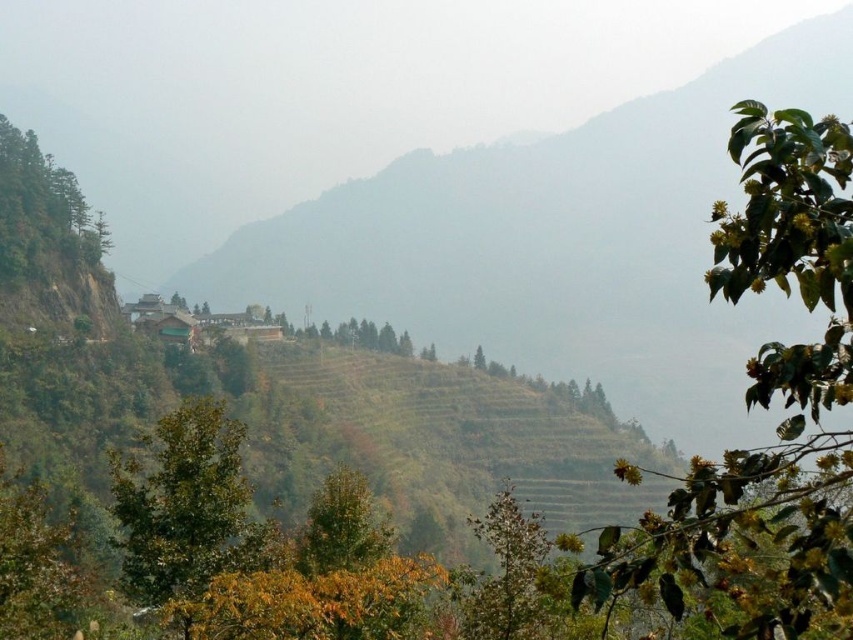
You are standing at the point marked at coordinate (x=186, y=506) in the image. What object are you standing on?

The point at coordinate (x=186, y=506) is on the green matte tree at lower left.

You are standing at the base of the mountain and looking up at the green matte tree at lower left and the green matte tree at center. Which tree is positioned higher up in the scene?

The green matte tree at lower left is positioned higher up in the scene than the green matte tree at center.

Looking at this image, you are standing at the origin point of the coordinate system in the image. You want to walk to the green matte tree at lower left. Which direction should you move in terms of x and y coordinates?

The green matte tree at lower left is located at coordinate point 0.792 in the x direction and 0.219 in the y direction. Since you are at the origin, you should move in the positive x and positive y directions to reach it.